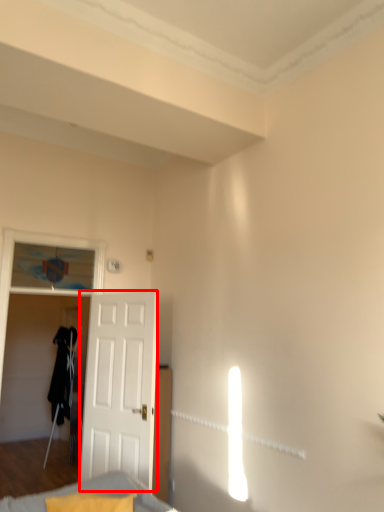
Question: From the image, what is the correct spatial relationship of door (annotated by the red box) in relation to furniture?

Choices:
 (A) left
 (B) right

Answer: (A)